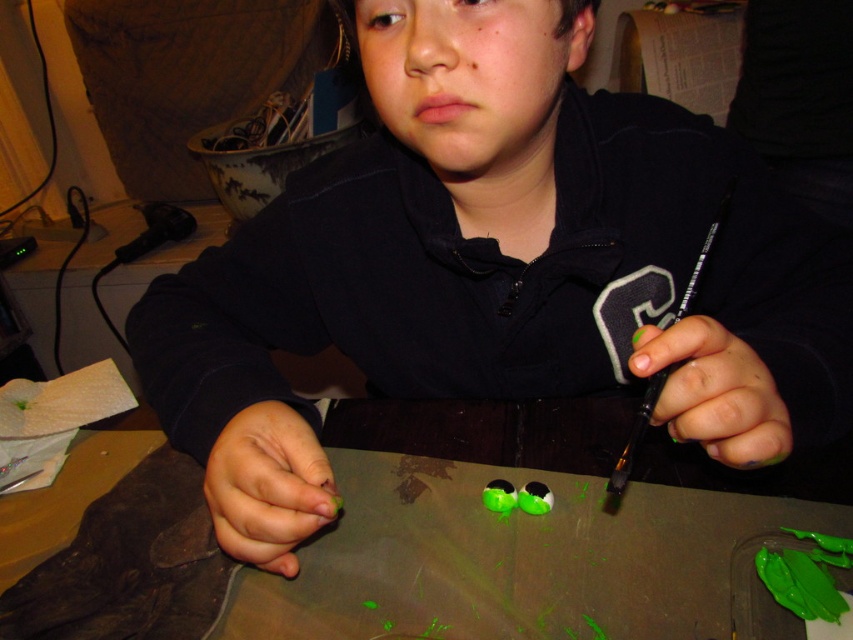
Question: Which point is closer to the camera?

Choices:
 (A) green matte nail polish at right
 (B) green matte table at center

Answer: (A)

Question: Is green matte table at center wider than green matte fingernail at lower center?

Choices:
 (A) no
 (B) yes

Answer: (B)

Question: Is green matte fingernail at lower center smaller than green matte nail polish at right?

Choices:
 (A) yes
 (B) no

Answer: (B)

Question: Which point is farther from the camera taking this photo?

Choices:
 (A) (717, 355)
 (B) (253, 554)

Answer: (B)

Question: Among these points, which one is nearest to the camera?

Choices:
 (A) (714, 452)
 (B) (253, 509)

Answer: (A)

Question: In this image, where is green matte fingernail at lower center located relative to green matte nail polish at right?

Choices:
 (A) below
 (B) above

Answer: (A)